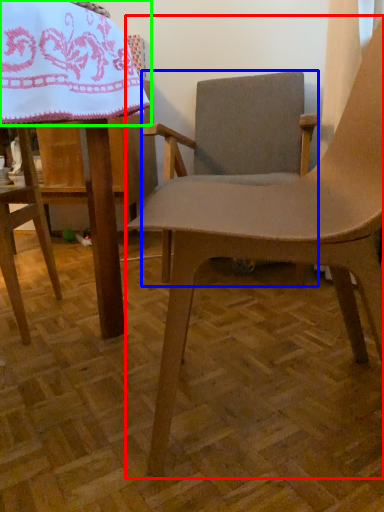
Question: Which object is the farthest from chair (highlighted by a red box)? Choose among these: chair (highlighted by a blue box) or blanket (highlighted by a green box).

Choices:
 (A) chair
 (B) blanket

Answer: (A)